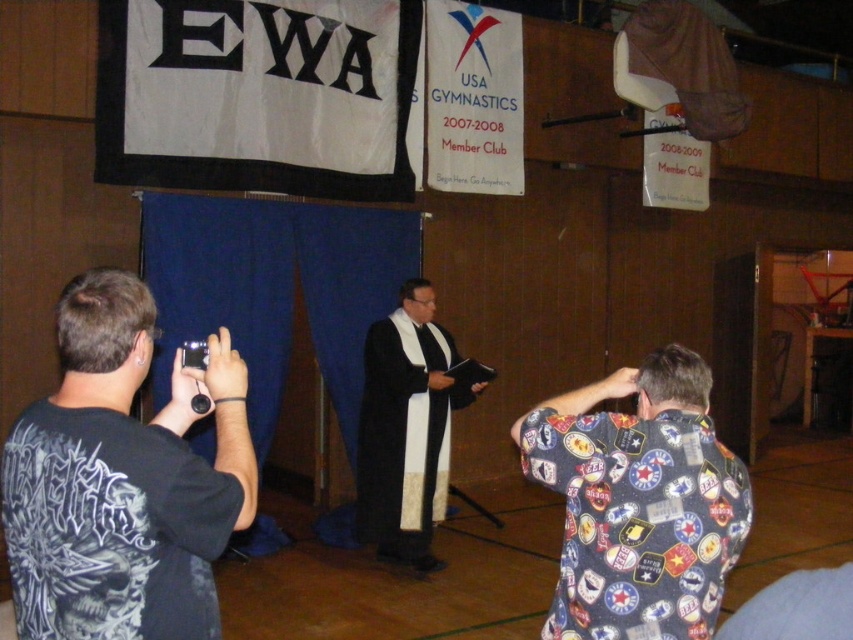
Question: Which object is the farthest from the black matte shirt at left?

Choices:
 (A) printed patchwork shirt at right
 (B) black matte robe at center

Answer: (B)

Question: Where is black matte shirt at left located in relation to black matte robe at center in the image?

Choices:
 (A) above
 (B) below

Answer: (A)

Question: Among these points, which one is farthest from the camera?

Choices:
 (A) (434, 346)
 (B) (723, 573)
 (C) (134, 378)

Answer: (A)

Question: Which object is closer to the camera taking this photo?

Choices:
 (A) black matte robe at center
 (B) printed patchwork shirt at right
 (C) black matte shirt at left

Answer: (C)

Question: Can you confirm if black matte shirt at left is positioned below printed patchwork shirt at right?

Choices:
 (A) no
 (B) yes

Answer: (A)

Question: Where is black matte shirt at left located in relation to printed patchwork shirt at right in the image?

Choices:
 (A) below
 (B) above

Answer: (B)